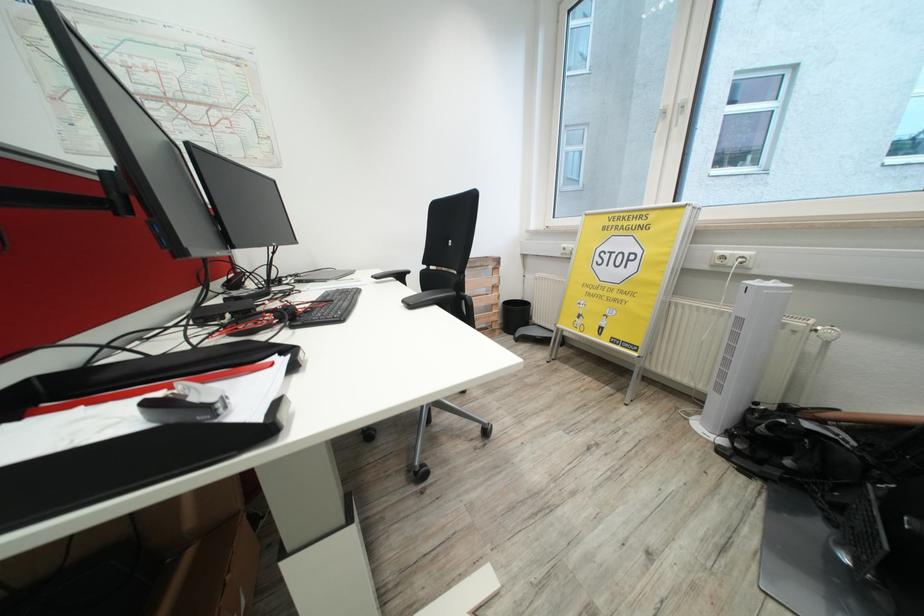
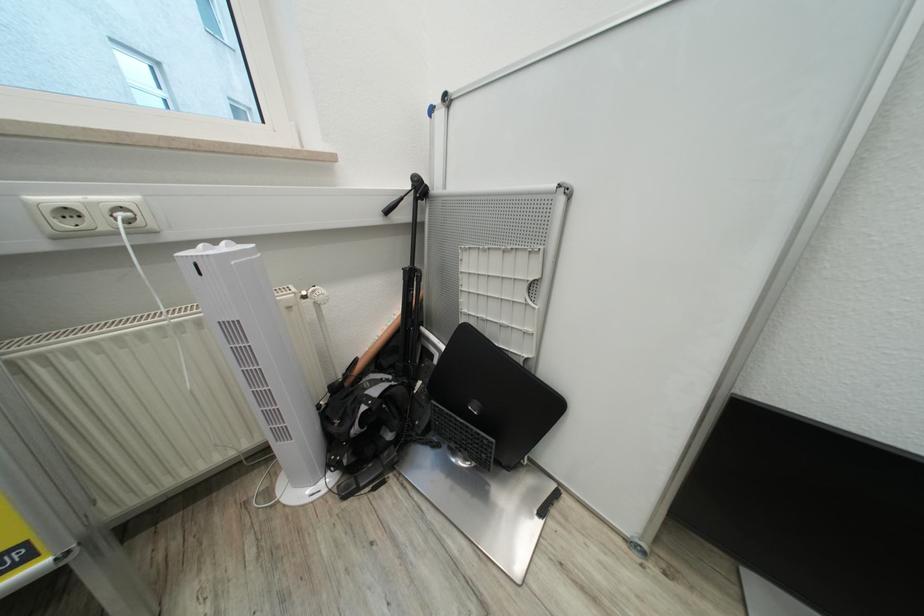
Based on the continuous images, in which direction is the camera rotating?

The camera's rotation is toward right-down.